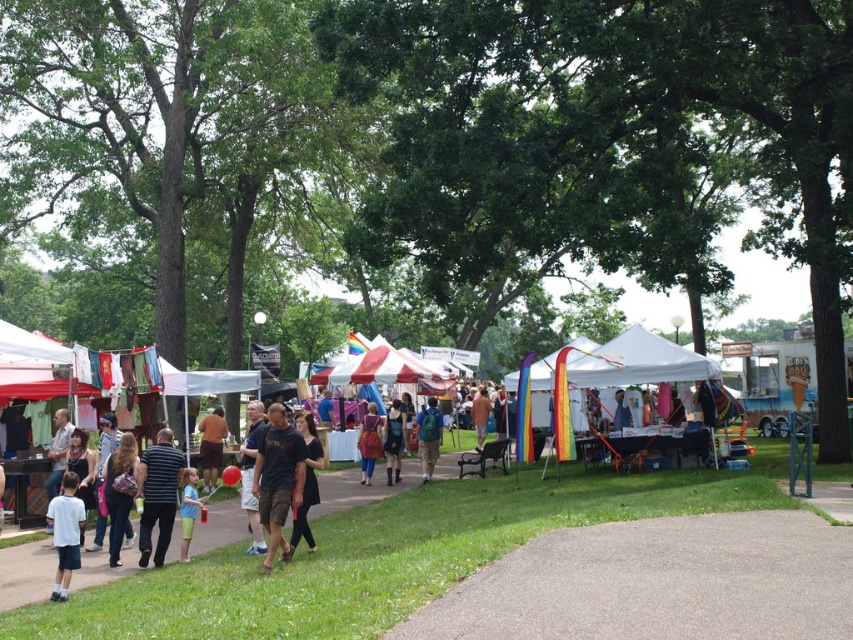
Is denim jeans at lower left shorter than dark gray shirt at center?

Correct, denim jeans at lower left is not as tall as dark gray shirt at center.

Which is behind, point (136, 467) or point (289, 548)?

Point (136, 467)

Identify the location of denim jeans at lower left. The image size is (853, 640). (119, 492).

This screenshot has height=640, width=853. What do you see at coordinates (277, 480) in the screenshot? I see `black matte shirt at center` at bounding box center [277, 480].

Is point (294, 481) closer to viewer compared to point (476, 417)?

Yes, point (294, 481) is closer to viewer.

This screenshot has width=853, height=640. Identify the location of black matte shirt at center. (277, 480).

Can you confirm if striped cotton shirt at lower left is shorter than brown cotton shirt at center?

No, striped cotton shirt at lower left is not shorter than brown cotton shirt at center.

Between striped cotton shirt at lower left and brown cotton shirt at center, which one is positioned higher?

striped cotton shirt at lower left

I want to click on striped cotton shirt at lower left, so click(x=158, y=493).

Identify the location of striped cotton shirt at lower left. (158, 493).